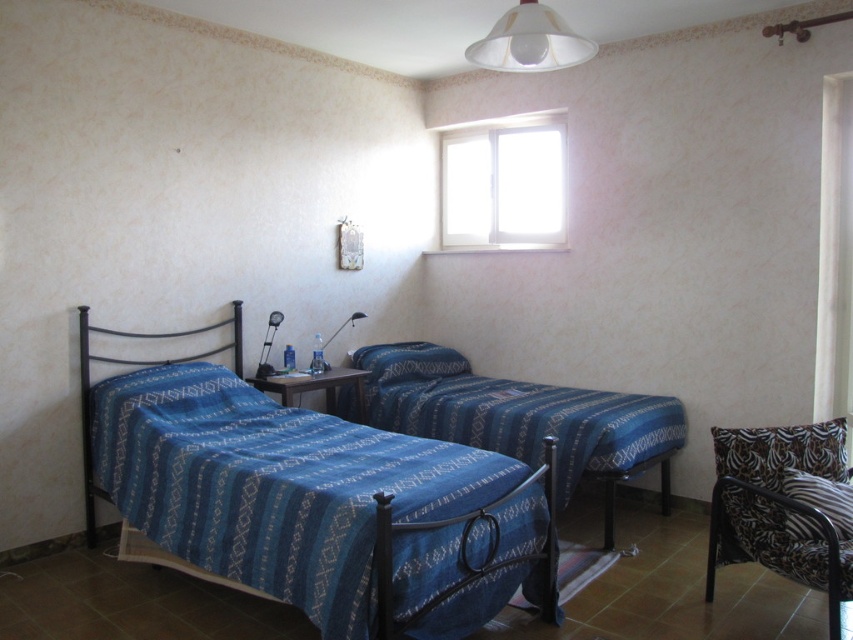
How distant is blue woven fabric bed at center from white matte lampshade at upper center?

blue woven fabric bed at center and white matte lampshade at upper center are 2.03 meters apart.

Can you confirm if blue woven fabric bed at center is positioned to the left of white matte lampshade at upper center?

No, blue woven fabric bed at center is not to the left of white matte lampshade at upper center.

Locate an element on the screen. Image resolution: width=853 pixels, height=640 pixels. blue woven fabric bed at center is located at coordinates (521, 417).

Who is taller, blue fabric bed at left or zebra-patterned fabric chair at lower right?

With more height is blue fabric bed at left.

Which is behind, point (209, 467) or point (752, 520)?

Positioned behind is point (209, 467).

Where is `blue fabric bed at left`? This screenshot has width=853, height=640. blue fabric bed at left is located at coordinates (320, 504).

Is zebra-patterned fabric chair at lower right to the right of white glass window at upper center from the viewer's perspective?

Correct, you'll find zebra-patterned fabric chair at lower right to the right of white glass window at upper center.

Is point (796, 504) positioned in front of point (514, 189)?

Yes, point (796, 504) is closer to viewer.

This screenshot has width=853, height=640. I want to click on zebra-patterned fabric chair at lower right, so click(x=779, y=508).